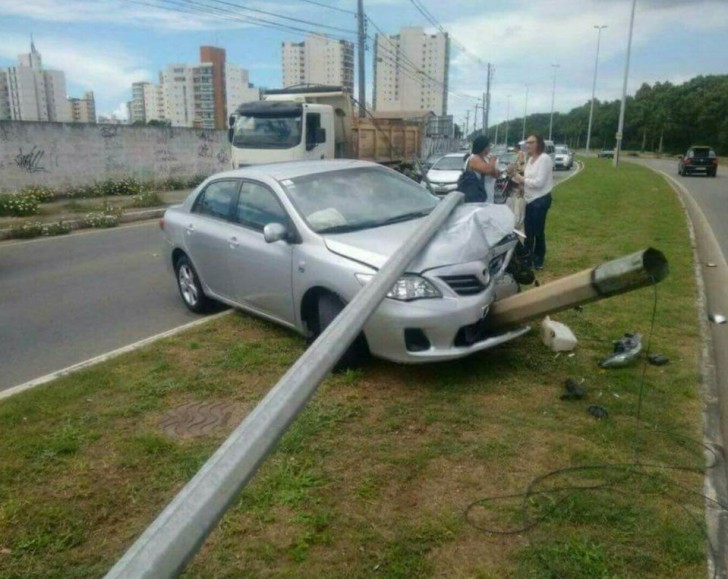
Where is `wall`? The height and width of the screenshot is (579, 728). wall is located at coordinates (127, 153), (23, 160), (210, 148), (437, 141), (461, 144).